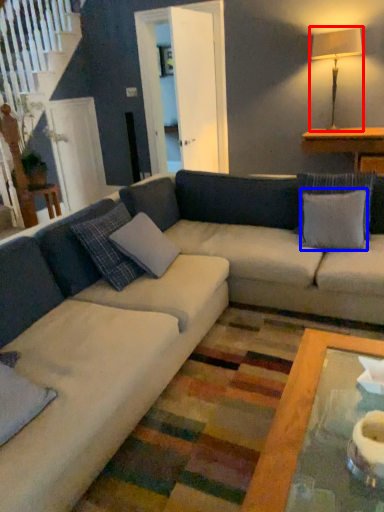
Question: Among these objects, which one is nearest to the camera, table lamp (highlighted by a red box) or pillow (highlighted by a blue box)?

Choices:
 (A) table lamp
 (B) pillow

Answer: (B)